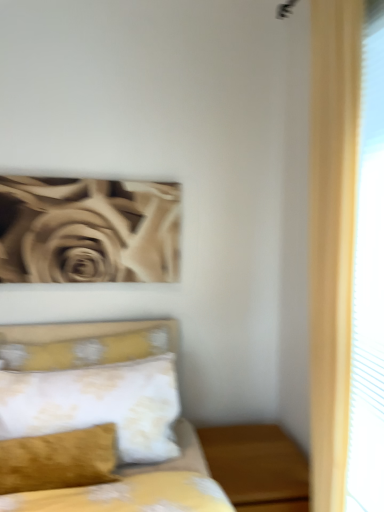
Question: Should I look upward or downward to see yellow floral fabric bed at lower left?

Choices:
 (A) up
 (B) down

Answer: (B)

Question: Can you confirm if yellow floral fabric bed at lower left is wider than wooden nightstand at lower right?

Choices:
 (A) yes
 (B) no

Answer: (B)

Question: Is wooden nightstand at lower right a part of yellow floral fabric bed at lower left?

Choices:
 (A) no
 (B) yes

Answer: (A)

Question: Does yellow floral fabric bed at lower left have a smaller size compared to wooden nightstand at lower right?

Choices:
 (A) yes
 (B) no

Answer: (B)

Question: Is yellow floral fabric bed at lower left completely or partially outside of wooden nightstand at lower right?

Choices:
 (A) no
 (B) yes

Answer: (B)

Question: Can you confirm if yellow floral fabric bed at lower left is positioned to the left of wooden nightstand at lower right?

Choices:
 (A) yes
 (B) no

Answer: (A)

Question: Considering the relative positions of yellow floral fabric bed at lower left and wooden nightstand at lower right in the image provided, is yellow floral fabric bed at lower left behind wooden nightstand at lower right?

Choices:
 (A) no
 (B) yes

Answer: (A)

Question: Can wooden nightstand at lower right be found inside floral-patterned fabric pillow at center-left?

Choices:
 (A) no
 (B) yes

Answer: (A)

Question: Is the depth of floral-patterned fabric pillow at center-left less than that of wooden nightstand at lower right?

Choices:
 (A) yes
 (B) no

Answer: (B)

Question: Considering the relative sizes of floral-patterned fabric pillow at center-left and wooden nightstand at lower right in the image provided, is floral-patterned fabric pillow at center-left thinner than wooden nightstand at lower right?

Choices:
 (A) yes
 (B) no

Answer: (A)

Question: From a real-world perspective, is floral-patterned fabric pillow at center-left positioned over wooden nightstand at lower right based on gravity?

Choices:
 (A) yes
 (B) no

Answer: (A)

Question: Considering the relative sizes of floral-patterned fabric pillow at center-left and wooden nightstand at lower right in the image provided, is floral-patterned fabric pillow at center-left shorter than wooden nightstand at lower right?

Choices:
 (A) yes
 (B) no

Answer: (A)

Question: Is floral-patterned fabric pillow at center-left at the right side of wooden nightstand at lower right?

Choices:
 (A) no
 (B) yes

Answer: (A)

Question: From the image's perspective, is floral-patterned fabric pillow at center-left located beneath yellow floral fabric bed at lower left?

Choices:
 (A) yes
 (B) no

Answer: (B)